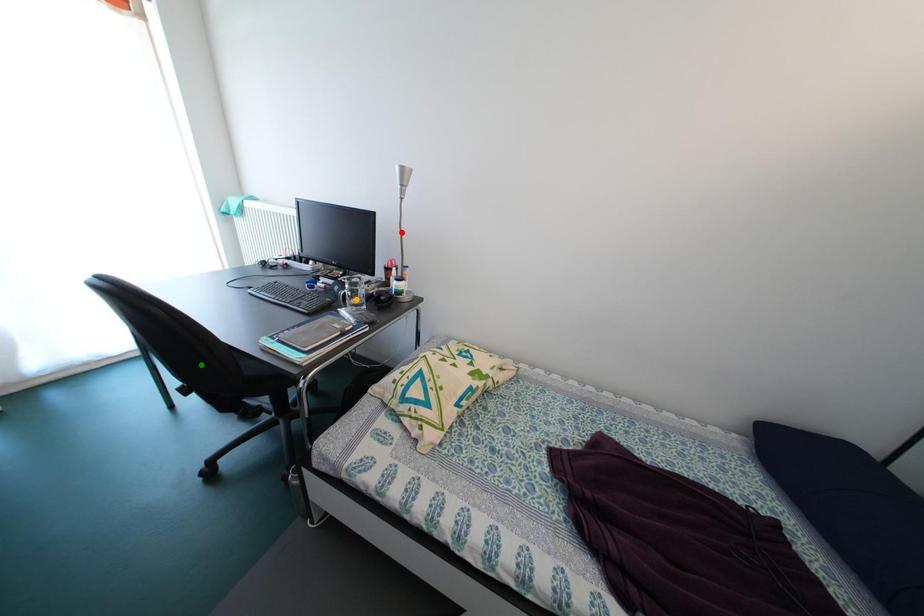
Order these from nearest to farthest:
green point, red point, orange point

green point < orange point < red point